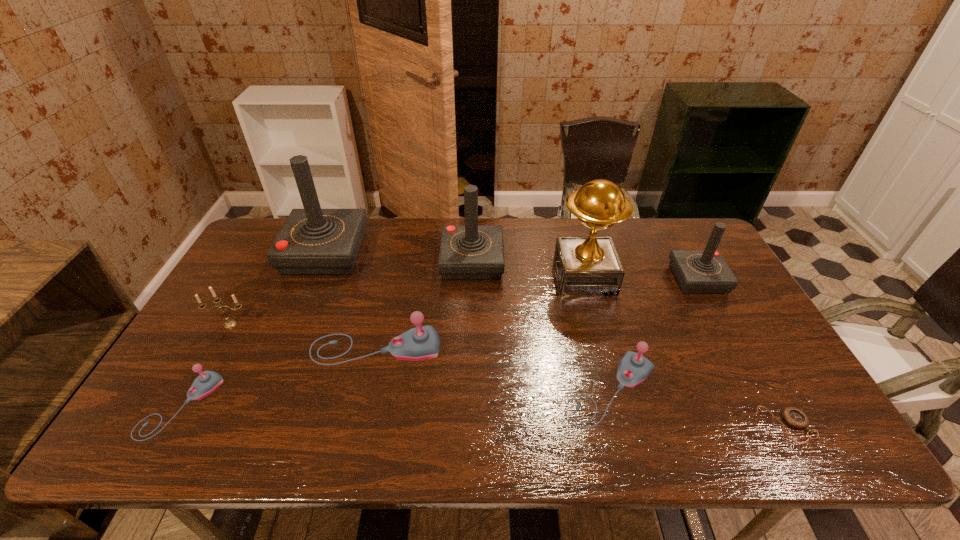
Where is `pocket watch at the near edge`? pocket watch at the near edge is located at coordinates (795, 417).

You are a GUI agent. You are given a task and a screenshot of the screen. Output one action in this format:
    pyautogui.click(x=<x>, y=<y>)
    Task: Click on the candle at the left edge
    
    Given the screenshot: What is the action you would take?
    pyautogui.click(x=230, y=323)

The image size is (960, 540). Identify the location of joystick that is at the right edge. (705, 271).

This screenshot has width=960, height=540. Identify the location of pocket watch positioned at the right edge. (795, 417).

Find the location of a particular element. This screenshot has width=960, height=540. object that is at the far left corner is located at coordinates [x=313, y=241].

Find the location of a particular element. This screenshot has height=540, width=960. object situated at the near left corner is located at coordinates (207, 381).

Find the location of a particular element. Image resolution: width=960 pixels, height=540 pixels. object located at the near right corner is located at coordinates (x=795, y=417).

This screenshot has height=540, width=960. In the image, there is a desktop. Find the location of `free space at the far edge`. free space at the far edge is located at coordinates 632,220.

Where is `free space at the near edge of the desktop`? free space at the near edge of the desktop is located at coordinates 671,434.

Locate an element on the screen. free space at the left edge of the desktop is located at coordinates (173, 367).